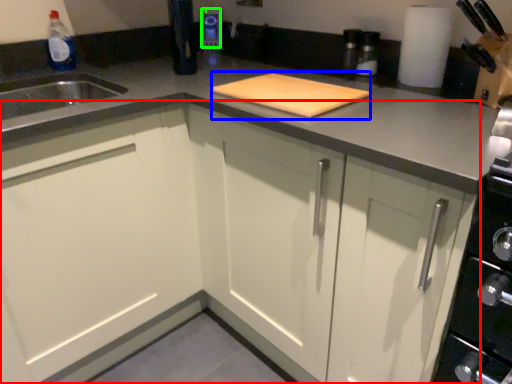
Question: Which is nearer to the cabinetry (highlighted by a red box)? cutting board (highlighted by a blue box) or appliance (highlighted by a green box).

Choices:
 (A) cutting board
 (B) appliance

Answer: (A)